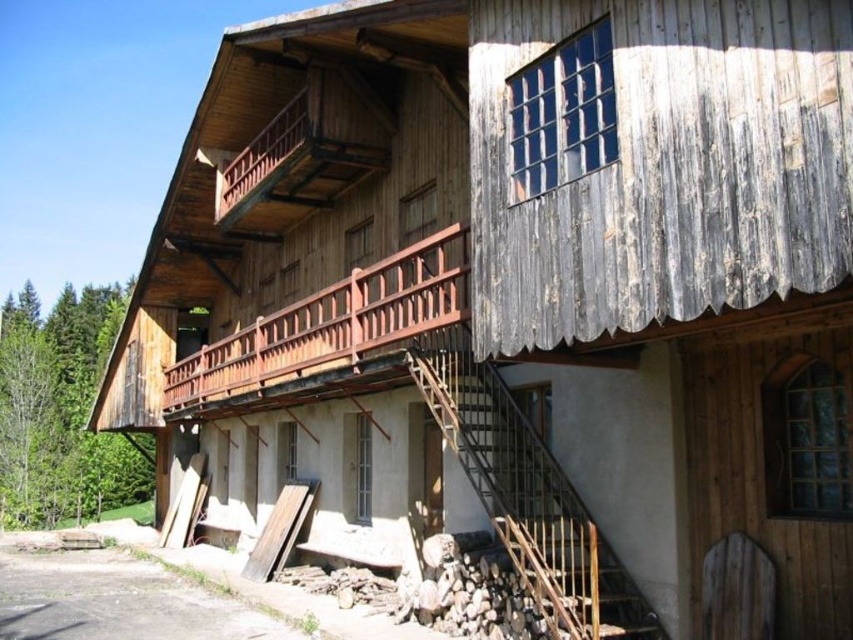
You are a delivery person carrying a large package and need to navigate through the area. The rusty metal staircase at lower right and the brown wooden balcony at center are in your path. Which of these two structures takes up more space in the scene?

The brown wooden balcony at center occupies more space than the rusty metal staircase at lower right according to the description.

You are a delivery person carrying a package that requires a clear path of at least 4 meters between the two brown wooden balconies. Can you safely navigate through the space between the brown wooden balcony at center and the brown wooden balcony at upper center?

The brown wooden balcony at center is 4.14 meters from the brown wooden balcony at upper center, so yes, you can safely navigate through the space between them as the distance meets the required 4 meters.